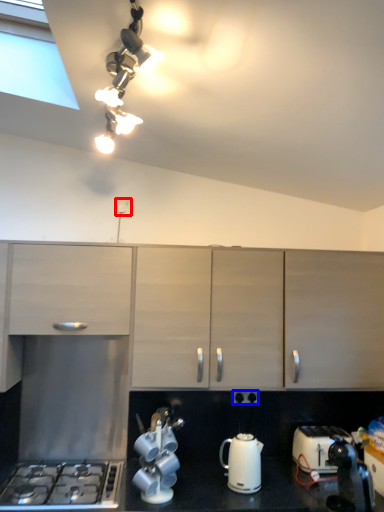
Question: Among these objects, which one is nearest to the camera, electric outlet (highlighted by a red box) or electric outlet (highlighted by a blue box)?

Choices:
 (A) electric outlet
 (B) electric outlet

Answer: (B)